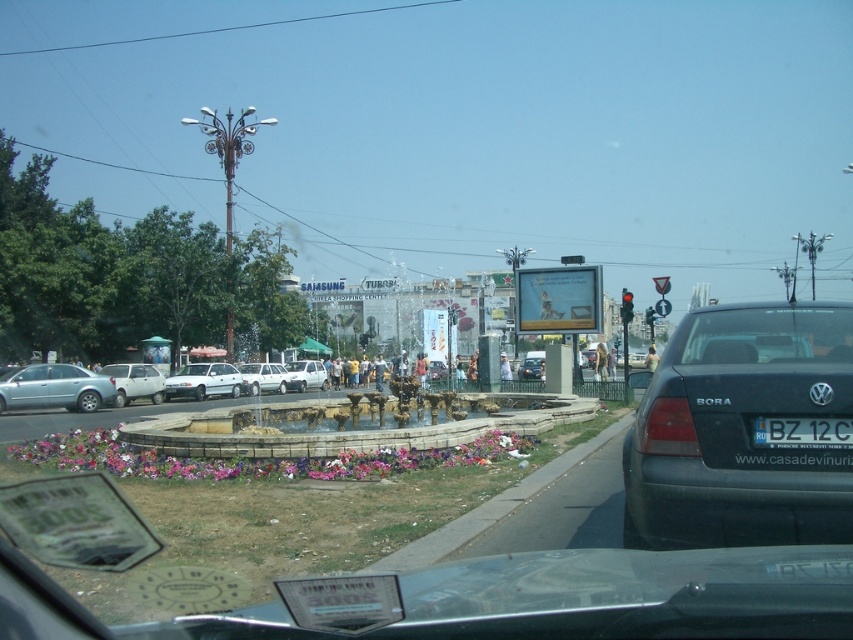
You are driving a car and want to check the license plate number of the white matte car at center. However, the white plastic license plate at center is blocking your view. Can you see the license plate number clearly?

The white plastic license plate at center is in front of the white matte car at center, so it is blocking the view of the license plate number.

You are a driver approaching the intersection and need to read both the white plastic license plate at center and the green glass traffic light at center. Which object will appear smaller in your view?

The white plastic license plate at center has a smaller size compared to the green glass traffic light at center, so it will appear smaller in your view.